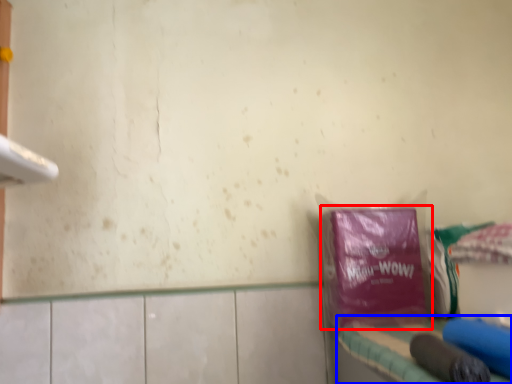
Question: Among these objects, which one is nearest to the camera, plastic bag (highlighted by a red box) or vanity (highlighted by a blue box)?

Choices:
 (A) plastic bag
 (B) vanity

Answer: (B)